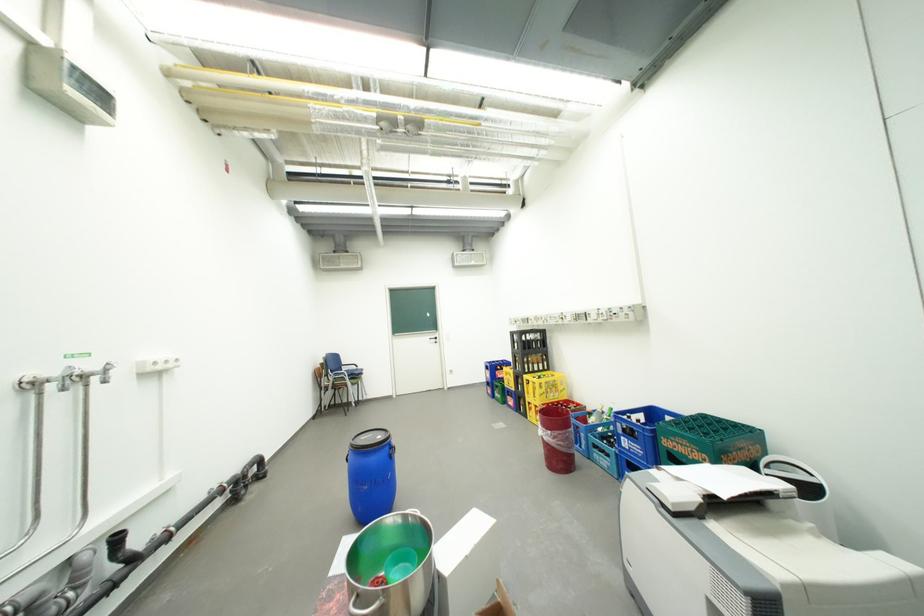
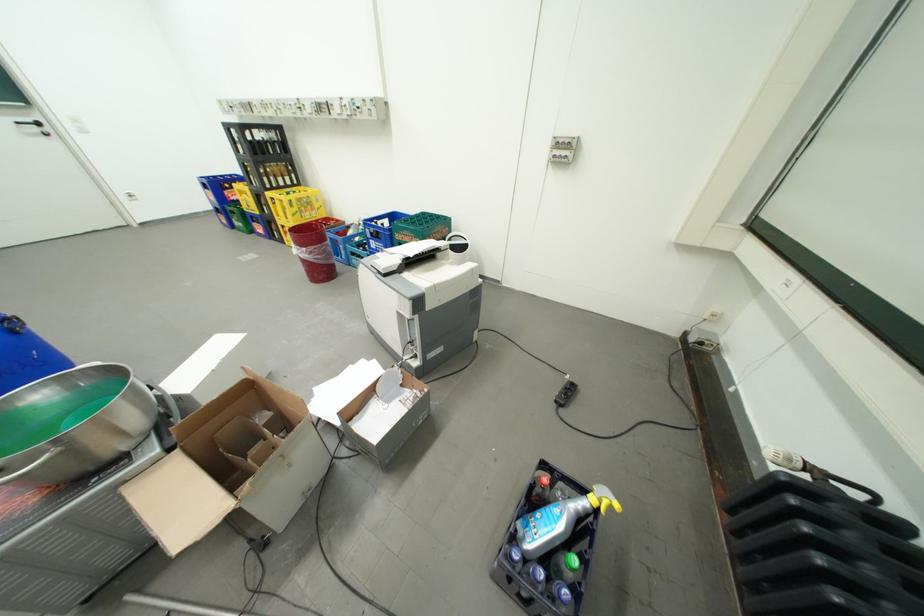
The point at [555,395] is marked in the first image. Where is the corresponding point in the second image?

(310, 215)